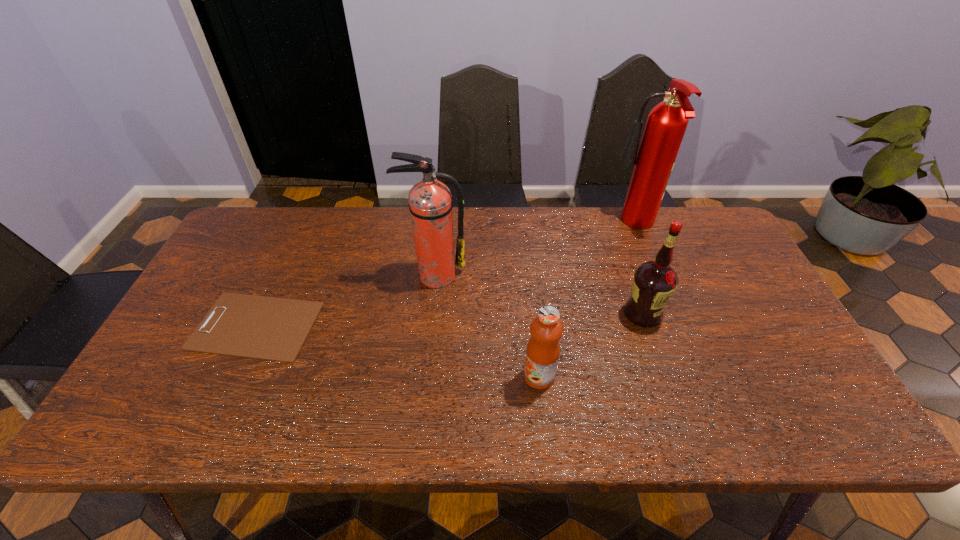
Locate an element on the screen. The height and width of the screenshot is (540, 960). free space at the far edge is located at coordinates (635, 239).

Locate an element on the screen. vacant space at the near edge of the desktop is located at coordinates (581, 411).

Image resolution: width=960 pixels, height=540 pixels. Identify the location of vacant space at the left edge. (211, 277).

You are a GUI agent. You are given a task and a screenshot of the screen. Output one action in this format:
    pyautogui.click(x=<x>, y=<y>)
    Task: Click on the blank space at the right edge of the desktop
    
    Given the screenshot: What is the action you would take?
    pyautogui.click(x=700, y=256)

Identify the location of vacant space at the far right corner of the desktop. (701, 250).

Image resolution: width=960 pixels, height=540 pixels. In order to click on vacant area at the near right corner of the desktop in this screenshot , I will do `click(824, 420)`.

The image size is (960, 540). Find the location of `empty space that is in between the leftmost object and the second farthest object`. empty space that is in between the leftmost object and the second farthest object is located at coordinates (346, 300).

This screenshot has width=960, height=540. I want to click on free area in between the fourth nearest object and the third object from right to left, so click(487, 326).

Locate an element on the screen. The image size is (960, 540). vacant area that lies between the clipboard and the fourth tallest object is located at coordinates (397, 351).

Locate an element on the screen. empty space that is in between the clipboard and the shorter fire extinguisher is located at coordinates (346, 300).